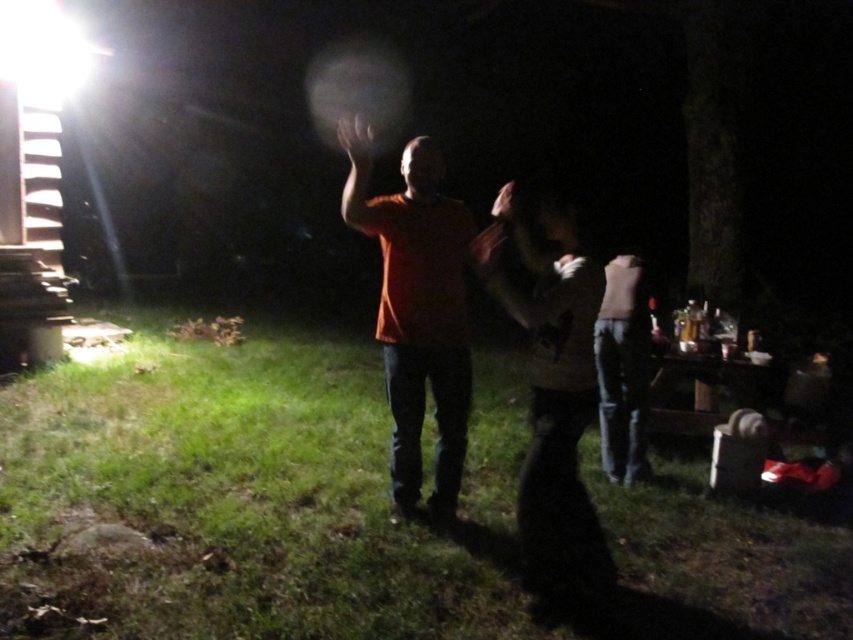
Who is more distant from viewer, (415, 161) or (630, 272)?

Positioned behind is point (630, 272).

Which is more to the left, orange matte shirt at center or matte brown sweater at center?

Positioned to the left is orange matte shirt at center.

Where is `orange matte shirt at center`? The height and width of the screenshot is (640, 853). orange matte shirt at center is located at coordinates (416, 310).

Locate an element on the screen. Image resolution: width=853 pixels, height=640 pixels. orange matte shirt at center is located at coordinates (416, 310).